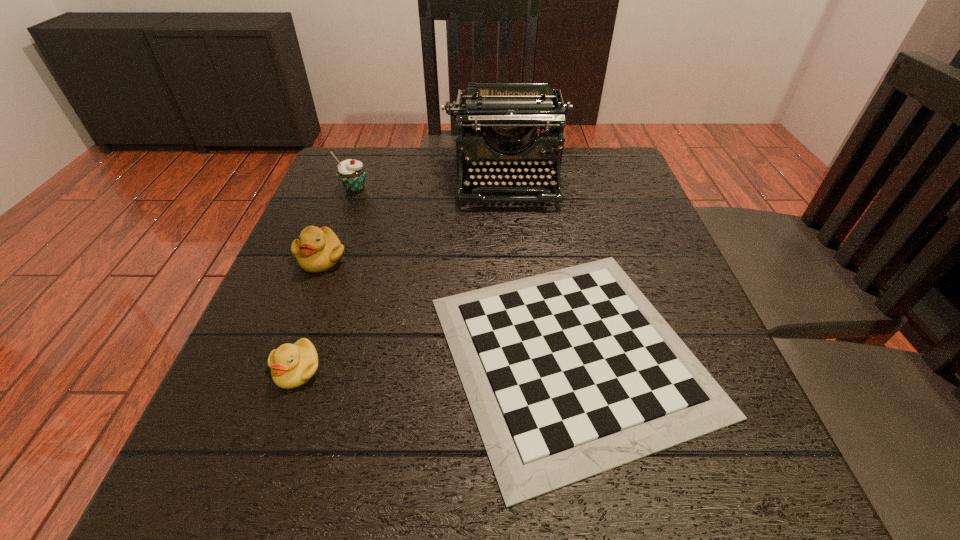
Locate an element on the screen. The height and width of the screenshot is (540, 960). free location located at the face of the nearer duckling is located at coordinates (278, 422).

Where is `vacant space located 0.250m on the left of the chessboard`? The width and height of the screenshot is (960, 540). vacant space located 0.250m on the left of the chessboard is located at coordinates (272, 354).

Where is `typewriter that is at the far edge`? The width and height of the screenshot is (960, 540). typewriter that is at the far edge is located at coordinates (507, 115).

Where is `cupcake present at the far edge`? The height and width of the screenshot is (540, 960). cupcake present at the far edge is located at coordinates (x=352, y=173).

The width and height of the screenshot is (960, 540). I want to click on object positioned at the near edge, so click(x=570, y=373).

Locate an element on the screen. The image size is (960, 540). cupcake that is at the left edge is located at coordinates (352, 173).

Locate an element on the screen. Image resolution: width=960 pixels, height=540 pixels. object that is at the right edge is located at coordinates (570, 373).

Where is `object positioned at the far left corner`? object positioned at the far left corner is located at coordinates (352, 173).

Locate an element on the screen. The height and width of the screenshot is (540, 960). object at the near right corner is located at coordinates (570, 373).

At what (x,y) coordinates should I click in order to perform the action: click on vacant space at the far edge. Please return your answer as a coordinate pair (x, y). The image size is (960, 540). Looking at the image, I should click on (425, 177).